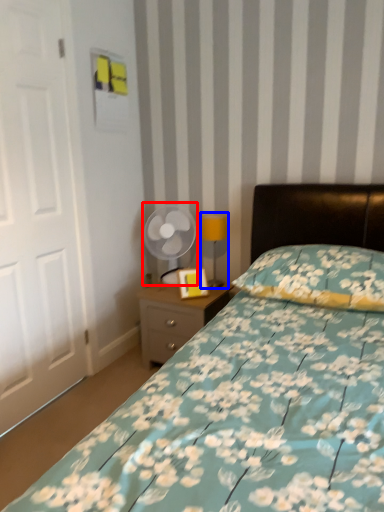
Question: Which point is further to the camera, mechanical fan (highlighted by a red box) or table lamp (highlighted by a blue box)?

Choices:
 (A) mechanical fan
 (B) table lamp

Answer: (A)